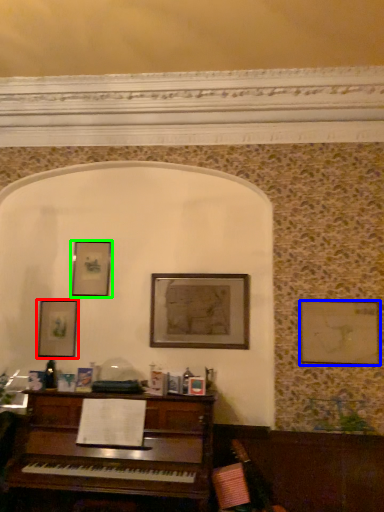
Question: Based on their relative distances, which object is nearer to picture frame (highlighted by a red box)? Choose from picture frame (highlighted by a blue box) and picture frame (highlighted by a green box).

Choices:
 (A) picture frame
 (B) picture frame

Answer: (B)